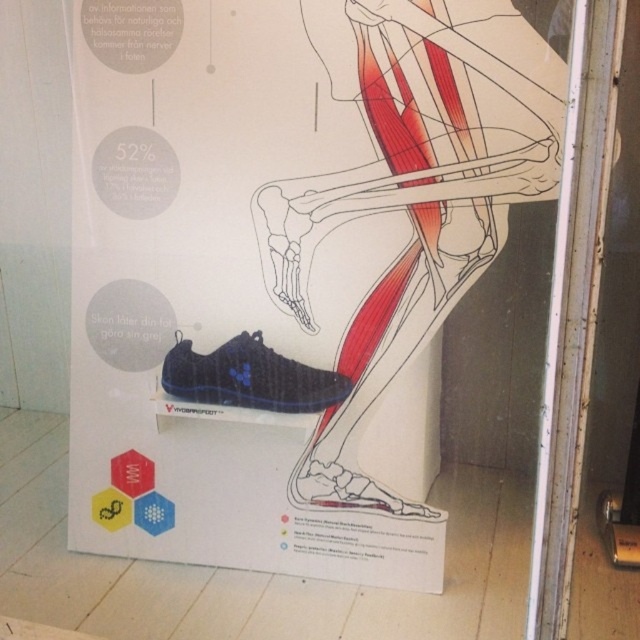
Looking at this image, you are standing in front of the foot anatomy display panel and notice two points marked on it. The first point is at coordinates point (x=276, y=380) and the second is at point (x=388, y=492). Which point is closer to you?

Point (x=276, y=380) is further to the viewer than point (x=388, y=492), so the second point is closer to you.

You are a customer at a shoe store and see the matte black shoe at lower left and the matte blue shoe at center displayed on a panel. The store has a rule that shoes must be placed at least 6 inches apart for safety. Do these two shoes meet the store requirement?

The distance between the matte black shoe at lower left and the matte blue shoe at center is 6.89 inches, which is more than the required 6 inches. Therefore, they meet the store requirement.